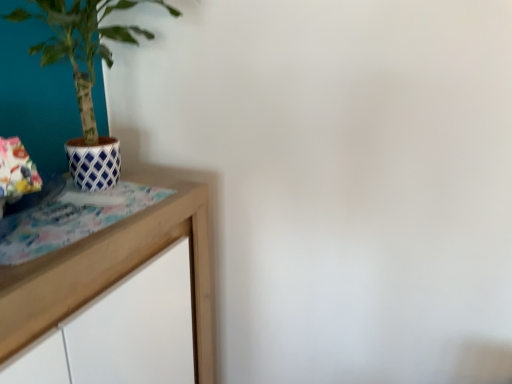
Question: In terms of height, does wooden table at left look taller or shorter compared to blue and white lattice pot at left?

Choices:
 (A) short
 (B) tall

Answer: (B)

Question: Is wooden table at left to the left or to the right of blue and white lattice pot at left in the image?

Choices:
 (A) left
 (B) right

Answer: (A)

Question: From a real-world perspective, is wooden table at left above or below blue and white lattice pot at left?

Choices:
 (A) below
 (B) above

Answer: (A)

Question: Considering the positions of point (92, 144) and point (35, 322), is point (92, 144) closer or farther from the camera than point (35, 322)?

Choices:
 (A) farther
 (B) closer

Answer: (A)

Question: In the image, is blue and white lattice pot at left positioned in front of or behind wooden table at left?

Choices:
 (A) front
 (B) behind

Answer: (B)

Question: Considering the positions of blue and white lattice pot at left and wooden table at left in the image, is blue and white lattice pot at left wider or thinner than wooden table at left?

Choices:
 (A) thin
 (B) wide

Answer: (A)

Question: Is blue and white lattice pot at left taller or shorter than wooden table at left?

Choices:
 (A) short
 (B) tall

Answer: (A)